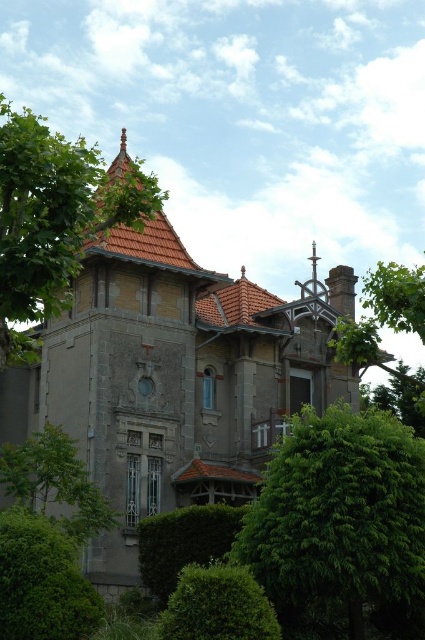
In the scene shown: You are standing in front of the grand building and notice two green leafy trees. One is the green leafy tree at left and the other is the green leafy tree at right. Which tree is closer to you?

The green leafy tree at left is closer to you because it is in front of the green leafy tree at right.

You are standing in front of the grand building and want to take a photo that includes both the green leafy tree at center and the green leafy bush at lower left. Which object should you position closer to the front of your camera frame?

You should position the green leafy tree at center closer to the front of your camera frame because it is closer to the viewer than the green leafy bush at lower left.

You are a landscape architect planning to place a new statue in the garden. The statue requires a space wider than the green leafy bush at lower left. Can the area near the green leafy tree at center accommodate the statue?

The green leafy tree at center has a larger width than the green leafy bush at lower left, so the area near the green leafy tree at center can accommodate the statue as it requires a space wider than the green leafy bush at lower left.